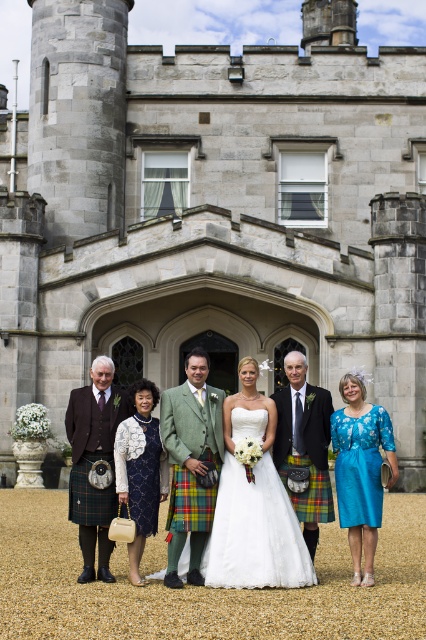
Question: Is turquoise silk dress at lower right positioned at the back of dark brown wool kilt at left?

Choices:
 (A) yes
 (B) no

Answer: (B)

Question: Considering the real-world distances, which object is farthest from the plaid wool kilt at center?

Choices:
 (A) dark brown wool kilt at left
 (B) matte green kilt at center
 (C) green wool suit at center

Answer: (A)

Question: Among these objects, which one is farthest from the camera?

Choices:
 (A) turquoise silk dress at lower right
 (B) matte green kilt at center

Answer: (A)

Question: Is the position of dark brown wool kilt at left more distant than that of blue textured dress at center?

Choices:
 (A) no
 (B) yes

Answer: (B)

Question: Does matte green kilt at center appear on the left side of green wool suit at center?

Choices:
 (A) yes
 (B) no

Answer: (B)

Question: Which point appears farthest from the camera in this image?

Choices:
 (A) 97,432
 (B) 279,454

Answer: (B)